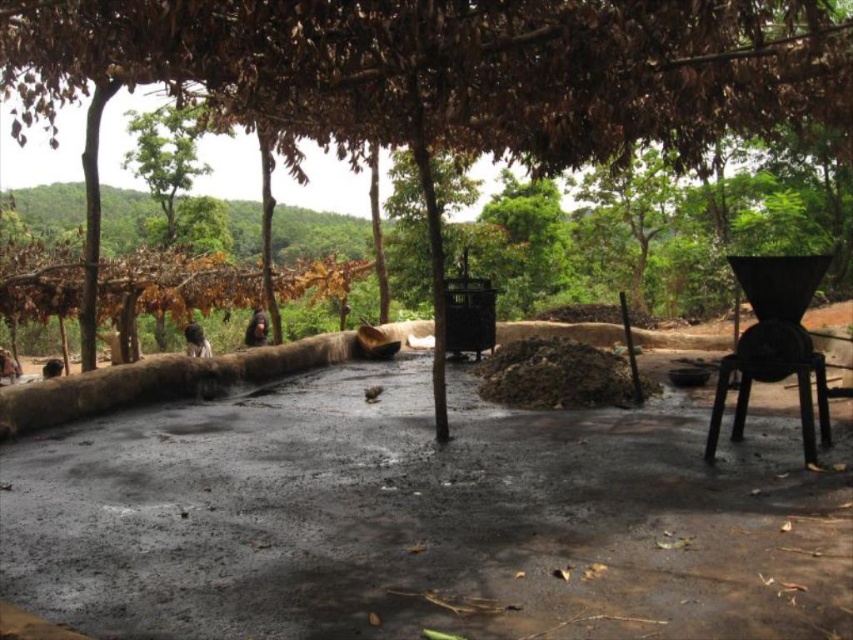
You are a visitor in this rural area and need to sit down. You see a brown leafy tree at center and a black plastic stool at lower right. Which object is smaller and suitable for sitting?

The black plastic stool at lower right is smaller than the brown leafy tree at center and suitable for sitting.

You are standing at the point marked as point (173,170) in the image. What object is located exactly at this point?

The green leafy tree at upper left is located exactly at point (173,170).